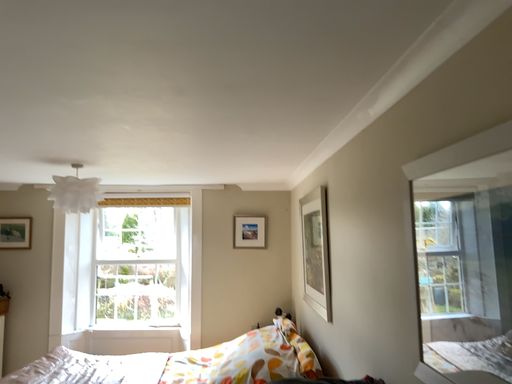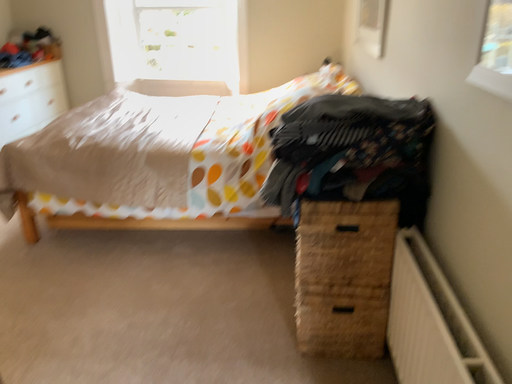
Question: How did the camera likely rotate when shooting the video?

Choices:
 (A) rotated downward
 (B) rotated upward

Answer: (A)